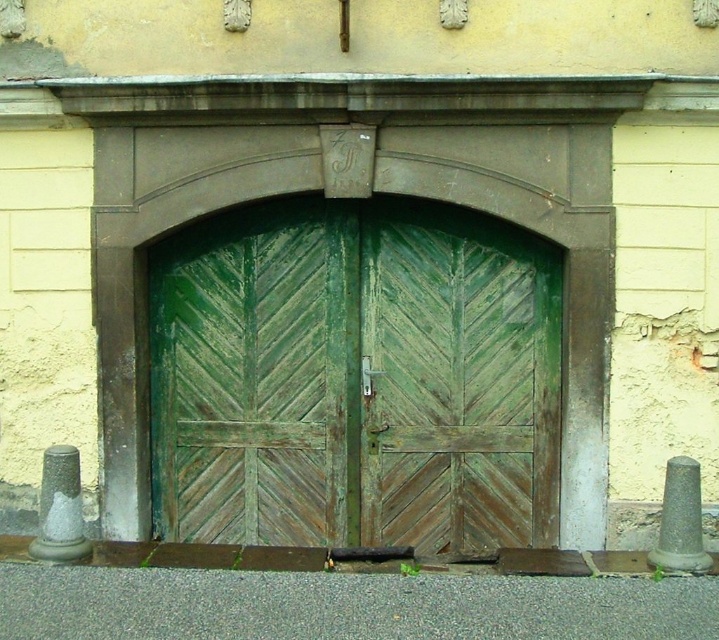
Question: Which of these objects is positioned farthest from the green wood/glass doors at center?

Choices:
 (A) green weathered wood door at center
 (B) green wood door at center

Answer: (B)

Question: Can you confirm if green wood/glass doors at center is wider than green weathered wood door at center?

Choices:
 (A) yes
 (B) no

Answer: (A)

Question: Which of these objects is positioned farthest from the green wood door at center?

Choices:
 (A) green weathered wood door at center
 (B) green wood/glass doors at center

Answer: (A)

Question: Considering the relative positions of green wood/glass doors at center and green wood door at center in the image provided, where is green wood/glass doors at center located with respect to green wood door at center?

Choices:
 (A) right
 (B) left

Answer: (B)

Question: Can you confirm if green wood/glass doors at center is wider than green wood door at center?

Choices:
 (A) no
 (B) yes

Answer: (B)

Question: Which point is closer to the camera taking this photo?

Choices:
 (A) (298, 333)
 (B) (233, 298)
 (C) (412, 346)

Answer: (C)